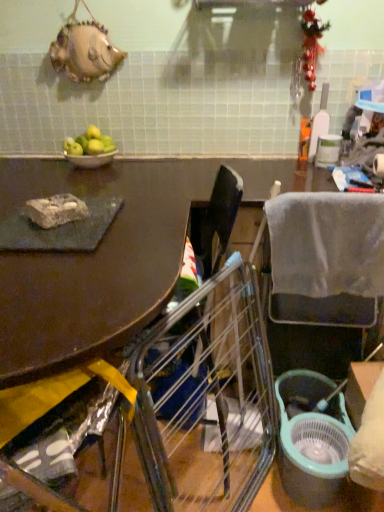
Question: Considering the relative sizes of metallic silver chair at lower left, which appears as the 1th chair when viewed from the front, and rocky stone at left in the image provided, is metallic silver chair at lower left, which appears as the 1th chair when viewed from the front, taller than rocky stone at left?

Choices:
 (A) yes
 (B) no

Answer: (A)

Question: From the image's perspective, is metallic silver chair at lower left, arranged as the 2th chair when viewed from the back, located beneath rocky stone at left?

Choices:
 (A) yes
 (B) no

Answer: (A)

Question: Does metallic silver chair at lower left, arranged as the 2th chair when viewed from the back, have a lesser height compared to rocky stone at left?

Choices:
 (A) yes
 (B) no

Answer: (B)

Question: Is metallic silver chair at lower left, arranged as the 2th chair when viewed from the back, not near rocky stone at left?

Choices:
 (A) no
 (B) yes

Answer: (A)

Question: From the image's perspective, is metallic silver chair at lower left, which appears as the 1th chair when viewed from the front, on rocky stone at left?

Choices:
 (A) no
 (B) yes

Answer: (A)

Question: In the image, is metallic silver chair at lower left, which appears as the 1th chair when viewed from the front, on the left side or the right side of gray fabric chair at right, arranged as the second chair when viewed from the front?

Choices:
 (A) right
 (B) left

Answer: (B)

Question: Based on their sizes in the image, would you say metallic silver chair at lower left, the 1th chair viewed from the left, is bigger or smaller than gray fabric chair at right, the 1th chair in the right-to-left sequence?

Choices:
 (A) big
 (B) small

Answer: (A)

Question: Is metallic silver chair at lower left, the second chair when ordered from right to left, situated inside gray fabric chair at right, the 1th chair in the right-to-left sequence, or outside?

Choices:
 (A) outside
 (B) inside

Answer: (A)

Question: Considering the positions of point (43, 498) and point (312, 231), is point (43, 498) closer or farther from the camera than point (312, 231)?

Choices:
 (A) closer
 (B) farther

Answer: (A)

Question: From a real-world perspective, is metallic silver chair at lower left, which appears as the 1th chair when viewed from the front, physically located above or below green matte apples at upper left?

Choices:
 (A) below
 (B) above

Answer: (A)

Question: From the image's perspective, is metallic silver chair at lower left, arranged as the 2th chair when viewed from the back, located above or below green matte apples at upper left?

Choices:
 (A) above
 (B) below

Answer: (B)

Question: In the image, is metallic silver chair at lower left, which appears as the 1th chair when viewed from the front, positioned in front of or behind green matte apples at upper left?

Choices:
 (A) behind
 (B) front

Answer: (B)

Question: From their relative heights in the image, would you say metallic silver chair at lower left, which appears as the 1th chair when viewed from the front, is taller or shorter than green matte apples at upper left?

Choices:
 (A) short
 (B) tall

Answer: (B)

Question: From a real-world perspective, is gray fabric chair at right, the second chair when ordered from left to right, physically located above or below rocky stone at left?

Choices:
 (A) below
 (B) above

Answer: (A)

Question: Looking at their shapes, would you say gray fabric chair at right, arranged as the second chair when viewed from the front, is wider or thinner than rocky stone at left?

Choices:
 (A) thin
 (B) wide

Answer: (B)